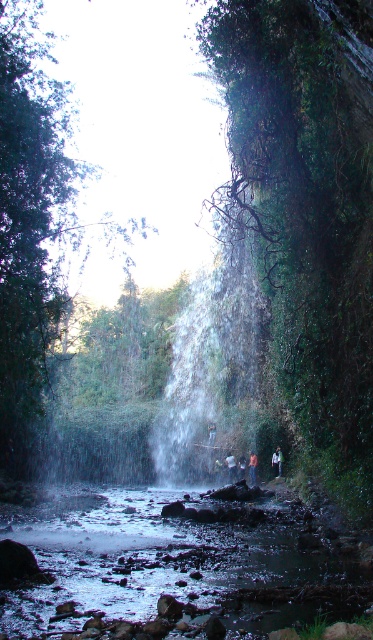
Is light blue denim jacket at center smaller than blue denim jeans at center?

No, light blue denim jacket at center is not smaller than blue denim jeans at center.

Describe the element at coordinates (277, 461) in the screenshot. I see `light blue denim jacket at center` at that location.

Identify the location of light blue denim jacket at center. (277, 461).

Is light blue denim jacket at center to the left of dark blue jeans at center from the viewer's perspective?

Incorrect, light blue denim jacket at center is not on the left side of dark blue jeans at center.

You are a GUI agent. You are given a task and a screenshot of the screen. Output one action in this format:
    pyautogui.click(x=<x>, y=<y>)
    Task: Click on the light blue denim jacket at center
    
    Given the screenshot: What is the action you would take?
    pyautogui.click(x=277, y=461)

Who is higher up, dark blue fabric person at center or dark blue jeans at center?

dark blue jeans at center

Does dark blue fabric person at center appear on the right side of dark blue jeans at center?

In fact, dark blue fabric person at center is to the left of dark blue jeans at center.

Measure the distance between dark blue fabric person at center and camera.

38.76 meters

What are the coordinates of `dark blue fabric person at center` in the screenshot? It's located at (230, 467).